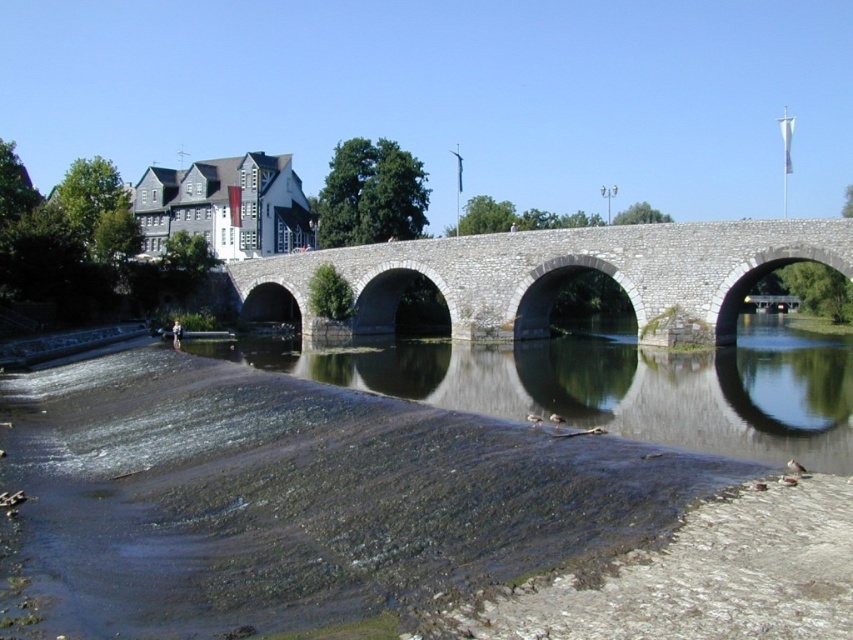
Question: Is brown stone river at center closer to the viewer compared to gray stone bridge at center?

Choices:
 (A) no
 (B) yes

Answer: (B)

Question: Can you confirm if brown stone river at center is positioned above gray stone bridge at center?

Choices:
 (A) no
 (B) yes

Answer: (A)

Question: Can you confirm if brown stone river at center is positioned below gray stone bridge at center?

Choices:
 (A) yes
 (B) no

Answer: (A)

Question: Which object appears farthest from the camera in this image?

Choices:
 (A) brown stone river at center
 (B) gray stone bridge at center

Answer: (B)